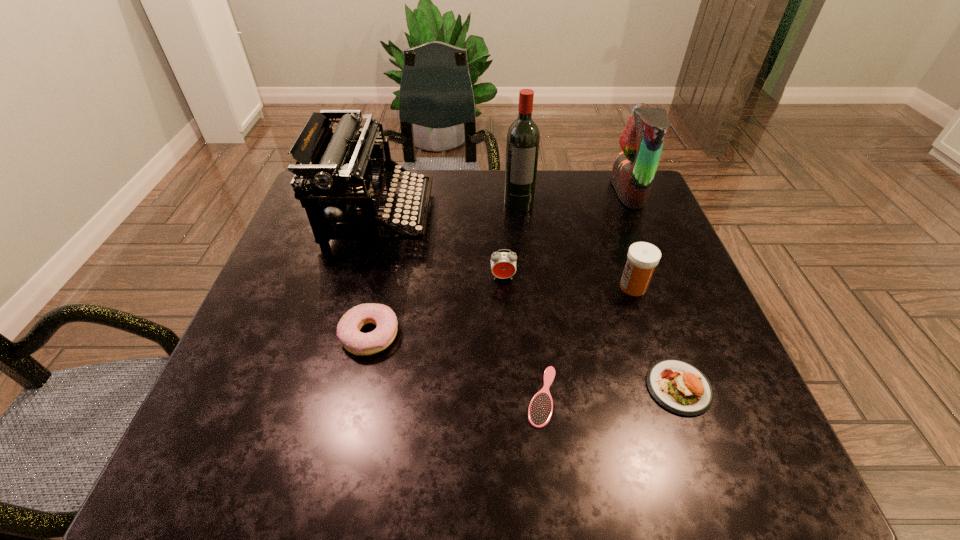
Image resolution: width=960 pixels, height=540 pixels. Identify the location of typewriter that is at the far edge. (347, 171).

You are a GUI agent. You are given a task and a screenshot of the screen. Output one action in this format:
    pyautogui.click(x=<x>, y=<y>)
    Task: Click on the object located at the near edge
    The width and height of the screenshot is (960, 540).
    Given the screenshot: What is the action you would take?
    pyautogui.click(x=540, y=409)

Find the location of a particular element. The width and height of the screenshot is (960, 540). object at the left edge is located at coordinates (347, 171).

The width and height of the screenshot is (960, 540). I want to click on parrot present at the right edge, so click(642, 140).

This screenshot has height=540, width=960. Identify the location of medicine located at the right edge. (642, 258).

Locate an element on the screen. patty (food) present at the right edge is located at coordinates 679,387.

This screenshot has height=540, width=960. I want to click on object at the far left corner, so click(x=347, y=171).

At what (x,y) coordinates should I click in order to perform the action: click on object situated at the far right corner. Please return your answer as a coordinate pair (x, y). The width and height of the screenshot is (960, 540). Looking at the image, I should click on (642, 140).

The height and width of the screenshot is (540, 960). In the image, there is a desktop. What are the coordinates of `vacant space at the far edge` in the screenshot? It's located at (574, 186).

At what (x,y) coordinates should I click in order to perform the action: click on free space at the near edge. Please return your answer as a coordinate pair (x, y). The height and width of the screenshot is (540, 960). Looking at the image, I should click on (339, 438).